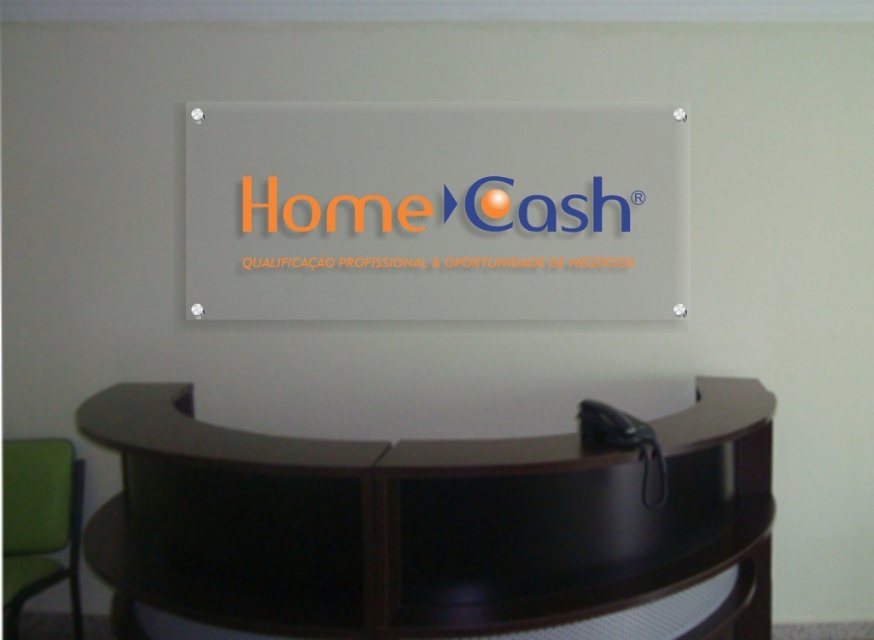
Between dark wood/finish reception desk at center and green fabric chair at lower left, which one has more height?

Standing taller between the two is dark wood/finish reception desk at center.

Does point (282, 518) come farther from viewer compared to point (67, 545)?

No, it is not.

This screenshot has width=874, height=640. In order to click on dark wood/finish reception desk at center in this screenshot , I will do `click(435, 525)`.

Describe the element at coordinates (435, 525) in the screenshot. I see `dark wood/finish reception desk at center` at that location.

Can you confirm if dark wood/finish reception desk at center is shorter than black leather phone at lower right?

No, dark wood/finish reception desk at center is not shorter than black leather phone at lower right.

I want to click on dark wood/finish reception desk at center, so click(x=435, y=525).

The image size is (874, 640). What do you see at coordinates (39, 524) in the screenshot?
I see `green fabric chair at lower left` at bounding box center [39, 524].

Between green fabric chair at lower left and black leather phone at lower right, which one appears on the left side from the viewer's perspective?

green fabric chair at lower left

Is point (15, 570) in front of point (642, 445)?

No, it is not.

Image resolution: width=874 pixels, height=640 pixels. Identify the location of green fabric chair at lower left. (39, 524).